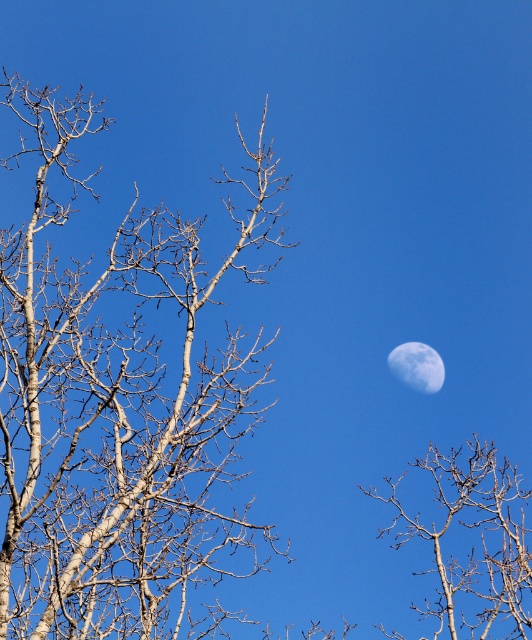
Does white smooth birch tree at left appear under smooth white moon at upper right?

Correct, white smooth birch tree at left is located below smooth white moon at upper right.

Who is positioned more to the left, white smooth birch tree at left or smooth white moon at upper right?

white smooth birch tree at left

This screenshot has height=640, width=532. What are the coordinates of `white smooth birch tree at left` in the screenshot? It's located at click(x=120, y=406).

Is the position of smooth bark tree at right less distant than that of smooth white moon at upper right?

That is True.

Can you confirm if smooth bark tree at right is thinner than smooth white moon at upper right?

No.

Where is `smooth bark tree at right`? smooth bark tree at right is located at coordinates (472, 545).

Who is shorter, white smooth birch tree at left or smooth bark tree at right?

With less height is smooth bark tree at right.

Between white smooth birch tree at left and smooth bark tree at right, which one appears on the right side from the viewer's perspective?

smooth bark tree at right is more to the right.

Does point (232, 550) come farther from viewer compared to point (461, 518)?

That is False.

The width and height of the screenshot is (532, 640). What are the coordinates of `white smooth birch tree at left` in the screenshot? It's located at (120, 406).